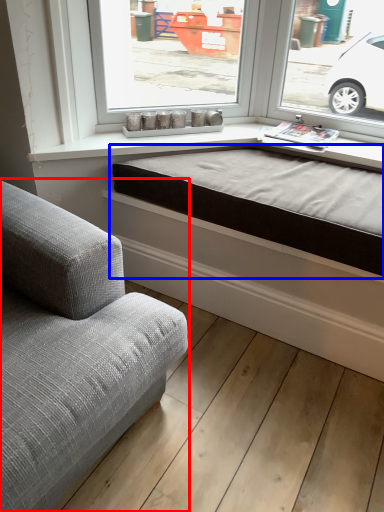
Question: Which point is closer to the camera, studio couch (highlighted by a red box) or bed frame (highlighted by a blue box)?

Choices:
 (A) studio couch
 (B) bed frame

Answer: (A)